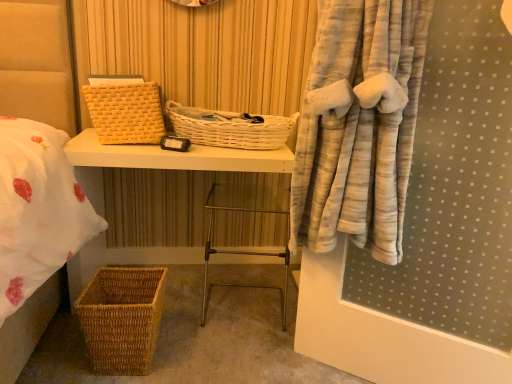
The height and width of the screenshot is (384, 512). What are the coordinates of `woven wicker basket at lower left` in the screenshot? It's located at (174, 157).

In order to click on woven brown basket at lower left, placed as the first basket when sorted from bottom to top in this screenshot , I will do `click(121, 319)`.

The height and width of the screenshot is (384, 512). Find the location of `white wicker basket at center, the 2th basket in the top-to-bottom sequence`. white wicker basket at center, the 2th basket in the top-to-bottom sequence is located at coordinates (230, 128).

Which is less distant, (110,150) or (124,114)?

Point (110,150).

Is woven wicker basket at lower left in contact with yellow woven basket at upper left, which is the 3th basket from bottom to top?

They are not placed beside each other.

From a real-world perspective, is woven wicker basket at lower left on top of yellow woven basket at upper left, the first basket viewed from the top?

No.

Looking at this image, considering the sizes of objects white wicker basket at center, which is the 2th basket in bottom-to-top order, and woven wicker basket at lower left in the image provided, who is taller, white wicker basket at center, which is the 2th basket in bottom-to-top order, or woven wicker basket at lower left?

Standing taller between the two is woven wicker basket at lower left.

Relative to woven wicker basket at lower left, is white wicker basket at center, the 2th basket in the top-to-bottom sequence, in front or behind?

Clearly, white wicker basket at center, the 2th basket in the top-to-bottom sequence, is behind woven wicker basket at lower left.

Does white wicker basket at center, which is the 2th basket in bottom-to-top order, have a greater width compared to woven wicker basket at lower left?

In fact, white wicker basket at center, which is the 2th basket in bottom-to-top order, might be narrower than woven wicker basket at lower left.

From a real-world perspective, is white wicker basket at center, the 2th basket in the top-to-bottom sequence, positioned over woven wicker basket at lower left based on gravity?

Yes, from a real-world perspective, white wicker basket at center, the 2th basket in the top-to-bottom sequence, is over woven wicker basket at lower left

How different are the orientations of yellow woven basket at upper left, which is the 3th basket from bottom to top, and woven brown basket at lower left, placed as the first basket when sorted from bottom to top, in degrees?

14.1 degrees separate the facing orientations of yellow woven basket at upper left, which is the 3th basket from bottom to top, and woven brown basket at lower left, placed as the first basket when sorted from bottom to top.

Which of these two, yellow woven basket at upper left, the first basket viewed from the top, or woven brown basket at lower left, which is the 3th basket in top-to-bottom order, is smaller?

With smaller size is woven brown basket at lower left, which is the 3th basket in top-to-bottom order.

Consider the image. Are yellow woven basket at upper left, the first basket viewed from the top, and woven brown basket at lower left, placed as the first basket when sorted from bottom to top, beside each other?

No, yellow woven basket at upper left, the first basket viewed from the top, is not in contact with woven brown basket at lower left, placed as the first basket when sorted from bottom to top.

Consider the image. Which of these two, yellow woven basket at upper left, the first basket viewed from the top, or woven brown basket at lower left, placed as the first basket when sorted from bottom to top, is thinner?

woven brown basket at lower left, placed as the first basket when sorted from bottom to top.

In terms of size, does yellow woven basket at upper left, the first basket viewed from the top, appear bigger or smaller than white wicker basket at center, the 2th basket in the top-to-bottom sequence?

Clearly, yellow woven basket at upper left, the first basket viewed from the top, is larger in size than white wicker basket at center, the 2th basket in the top-to-bottom sequence.

How different are the orientations of yellow woven basket at upper left, which is the 3th basket from bottom to top, and white wicker basket at center, the 2th basket in the top-to-bottom sequence, in degrees?

The angle between the facing direction of yellow woven basket at upper left, which is the 3th basket from bottom to top, and the facing direction of white wicker basket at center, the 2th basket in the top-to-bottom sequence, is 11.4 degrees.

From the image's perspective, which one is positioned lower, yellow woven basket at upper left, the first basket viewed from the top, or white wicker basket at center, which is the 2th basket in bottom-to-top order?

white wicker basket at center, which is the 2th basket in bottom-to-top order, from the image's perspective.

From a real-world perspective, is yellow woven basket at upper left, the first basket viewed from the top, positioned above or below white wicker basket at center, which is the 2th basket in bottom-to-top order?

yellow woven basket at upper left, the first basket viewed from the top, is situated higher than white wicker basket at center, which is the 2th basket in bottom-to-top order, in the real world.

Is white wicker basket at center, which is the 2th basket in bottom-to-top order, beside woven brown basket at lower left, which is the 3th basket in top-to-bottom order?

They are not placed beside each other.

Would you say white wicker basket at center, which is the 2th basket in bottom-to-top order, is to the left or to the right of woven brown basket at lower left, which is the 3th basket in top-to-bottom order, in the picture?

white wicker basket at center, which is the 2th basket in bottom-to-top order, is positioned on woven brown basket at lower left, which is the 3th basket in top-to-bottom order,'s right side.

Is white wicker basket at center, the 2th basket in the top-to-bottom sequence, positioned with its back to woven brown basket at lower left, placed as the first basket when sorted from bottom to top?

No.

Is white wicker basket at center, which is the 2th basket in bottom-to-top order, aimed at metallic silver step stool at center?

No, white wicker basket at center, which is the 2th basket in bottom-to-top order, is not facing towards metallic silver step stool at center.

Does point (224, 128) come farther from viewer compared to point (226, 207)?

No.

Considering the relative sizes of white wicker basket at center, the 2th basket in the top-to-bottom sequence, and metallic silver step stool at center in the image provided, is white wicker basket at center, the 2th basket in the top-to-bottom sequence, taller than metallic silver step stool at center?

Incorrect, the height of white wicker basket at center, the 2th basket in the top-to-bottom sequence, is not larger of that of metallic silver step stool at center.

From a real-world perspective, between white wicker basket at center, the 2th basket in the top-to-bottom sequence, and metallic silver step stool at center, who is vertically lower?

From a 3D spatial view, metallic silver step stool at center is below.

Is yellow woven basket at upper left, the first basket viewed from the top, oriented away from woven wicker basket at lower left?

yellow woven basket at upper left, the first basket viewed from the top, does not have its back to woven wicker basket at lower left.

Does point (96, 102) lie behind point (137, 158)?

Yes, point (96, 102) is farther from viewer.

Would you say yellow woven basket at upper left, the first basket viewed from the top, is to the left or to the right of woven wicker basket at lower left in the picture?

Based on their positions, yellow woven basket at upper left, the first basket viewed from the top, is located to the left of woven wicker basket at lower left.

Is yellow woven basket at upper left, which is the 3th basket from bottom to top, far from woven wicker basket at lower left?

They are positioned close to each other.

Starting from the woven wicker basket at lower left, which basket is the 1st one in front? Please provide its 2D coordinates.

[(126, 113)]

Where is `furniture on the left of white wicker basket at center, the 2th basket in the top-to-bottom sequence`? The height and width of the screenshot is (384, 512). furniture on the left of white wicker basket at center, the 2th basket in the top-to-bottom sequence is located at coordinates (174, 157).

Looking at this image, when comparing their distances from woven wicker basket at lower left, does woven brown basket at lower left, which is the 3th basket in top-to-bottom order, or yellow woven basket at upper left, the first basket viewed from the top, seem closer?

Based on the image, yellow woven basket at upper left, the first basket viewed from the top, appears to be nearer to woven wicker basket at lower left.

Based on their spatial positions, is woven wicker basket at lower left or yellow woven basket at upper left, which is the 3th basket from bottom to top, further from white wicker basket at center, which is the 2th basket in bottom-to-top order?

Based on the image, yellow woven basket at upper left, which is the 3th basket from bottom to top, appears to be further to white wicker basket at center, which is the 2th basket in bottom-to-top order.

From the image, which object appears to be nearer to woven wicker basket at lower left, yellow woven basket at upper left, the first basket viewed from the top, or metallic silver step stool at center?

Based on the image, yellow woven basket at upper left, the first basket viewed from the top, appears to be nearer to woven wicker basket at lower left.

From the image, which object appears to be nearer to yellow woven basket at upper left, the first basket viewed from the top, white wicker basket at center, which is the 2th basket in bottom-to-top order, or metallic silver step stool at center?

white wicker basket at center, which is the 2th basket in bottom-to-top order, is positioned closer to the anchor yellow woven basket at upper left, the first basket viewed from the top.

Considering their positions, is woven wicker basket at lower left positioned closer to metallic silver step stool at center than yellow woven basket at upper left, the first basket viewed from the top?

Based on the image, woven wicker basket at lower left appears to be nearer to metallic silver step stool at center.

Which object lies nearer to the anchor point woven brown basket at lower left, placed as the first basket when sorted from bottom to top, metallic silver step stool at center or yellow woven basket at upper left, which is the 3th basket from bottom to top?

metallic silver step stool at center.

Estimate the real-world distances between objects in this image. Which object is further from yellow woven basket at upper left, which is the 3th basket from bottom to top, white wicker basket at center, which is the 2th basket in bottom-to-top order, or woven wicker basket at lower left?

white wicker basket at center, which is the 2th basket in bottom-to-top order, is positioned further to the anchor yellow woven basket at upper left, which is the 3th basket from bottom to top.

Which object lies nearer to the anchor point metallic silver step stool at center, woven brown basket at lower left, placed as the first basket when sorted from bottom to top, or woven wicker basket at lower left?

woven brown basket at lower left, placed as the first basket when sorted from bottom to top, lies closer to metallic silver step stool at center than the other object.

The width and height of the screenshot is (512, 384). I want to click on furniture between white wicker basket at center, which is the 2th basket in bottom-to-top order, and metallic silver step stool at center vertically, so click(174, 157).

Where is `furniture between yellow woven basket at upper left, the first basket viewed from the top, and woven brown basket at lower left, which is the 3th basket in top-to-bottom order, in the up-down direction`? This screenshot has width=512, height=384. furniture between yellow woven basket at upper left, the first basket viewed from the top, and woven brown basket at lower left, which is the 3th basket in top-to-bottom order, in the up-down direction is located at coordinates (174, 157).

The image size is (512, 384). Find the location of `basket between yellow woven basket at upper left, which is the 3th basket from bottom to top, and woven wicker basket at lower left from top to bottom`. basket between yellow woven basket at upper left, which is the 3th basket from bottom to top, and woven wicker basket at lower left from top to bottom is located at coordinates (230, 128).

Locate an element on the screen. step stool between yellow woven basket at upper left, which is the 3th basket from bottom to top, and woven brown basket at lower left, which is the 3th basket in top-to-bottom order, from top to bottom is located at coordinates (240, 254).